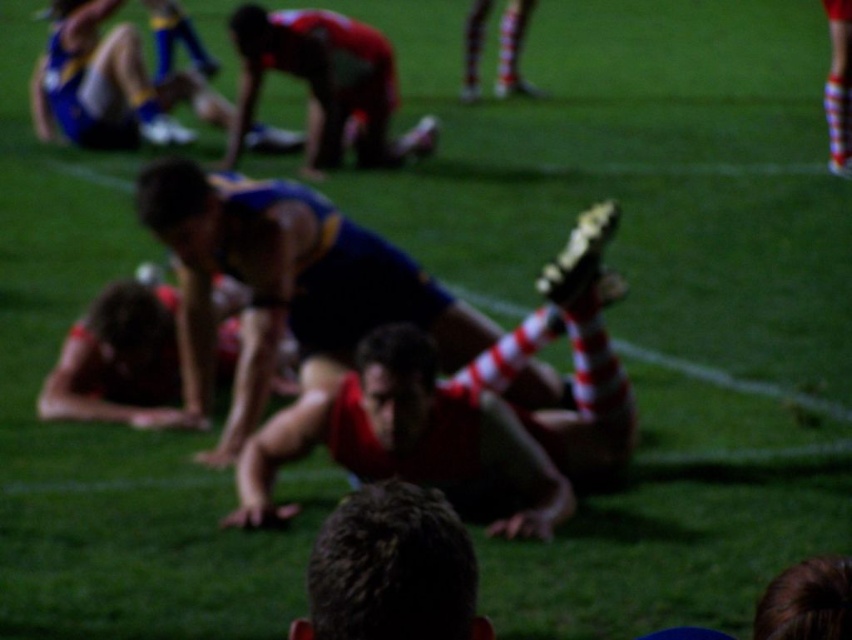
Question: Based on their relative distances, which object is nearer to the red fabric man at upper center?

Choices:
 (A) red and white striped sock at center
 (B) dark brown hair at center

Answer: (A)

Question: From the image, what is the correct spatial relationship of red and white striped sock at center in relation to red fabric man at upper center?

Choices:
 (A) right
 (B) left

Answer: (A)

Question: Which point is farther to the camera?

Choices:
 (A) red and white striped sock at center
 (B) red fabric man at upper center

Answer: (B)

Question: Can you confirm if dark brown hair at center is wider than red fabric man at upper center?

Choices:
 (A) yes
 (B) no

Answer: (B)

Question: Which point is farther from the camera taking this photo?

Choices:
 (A) (249, 452)
 (B) (430, 627)

Answer: (A)

Question: Can you confirm if red and white striped sock at center is positioned below dark brown hair at center?

Choices:
 (A) no
 (B) yes

Answer: (B)